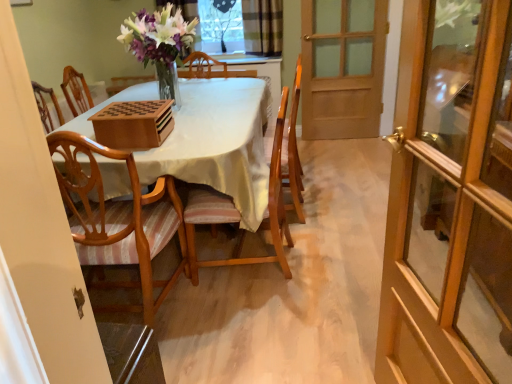
Identify the location of wooden door at right, which ranks as the first door in top-to-bottom order. The height and width of the screenshot is (384, 512). (342, 67).

Between point (280, 242) and point (77, 131), which one is positioned in front?

The point (77, 131) is closer to the camera.

Is wooden chair with striped cushion at center, positioned as the 1th chair in right-to-left order, thinner than wooden table at center?

Indeed, wooden chair with striped cushion at center, positioned as the 1th chair in right-to-left order, has a lesser width compared to wooden table at center.

Find the location of a particular element. This screenshot has width=512, height=384. chair on the right side of wooden table at center is located at coordinates (239, 213).

From a real-world perspective, is wooden chair with striped cushion at center, which appears as the 2th chair when viewed from the left, located higher than wooden table at center?

Yes, from a real-world perspective, wooden chair with striped cushion at center, which appears as the 2th chair when viewed from the left, is over wooden table at center

Is plaid fabric curtain at upper center positioned far away from light brown wood chair at left, the 2th chair when ordered from right to left?

Yes.

Find the location of a particular element. curtain lying on the right of light brown wood chair at left, the 2th chair when ordered from right to left is located at coordinates (263, 27).

Which object is further away from the camera taking this photo, plaid fabric curtain at upper center or light brown wood chair at left, which is the 1th chair from left to right?

plaid fabric curtain at upper center is further away from the camera.

From a real-world perspective, is plaid fabric curtain at upper center physically located above or below light brown wood chair at left, which is the 1th chair from left to right?

From a real-world perspective, plaid fabric curtain at upper center is physically above light brown wood chair at left, which is the 1th chair from left to right.

Can you confirm if wooden door at right, arranged as the 2th door when viewed from the front, is taller than wooden table at center?

Indeed, wooden door at right, arranged as the 2th door when viewed from the front, has a greater height compared to wooden table at center.

From a real-world perspective, between wooden door at right, the 1th door viewed from the back, and wooden table at center, who is vertically lower?

wooden table at center is physically lower.

In the image, is wooden door at right, arranged as the 2th door when viewed from the front, positioned in front of or behind wooden table at center?

wooden door at right, arranged as the 2th door when viewed from the front, is positioned farther from the viewer than wooden table at center.

Is wooden door at right, arranged as the 2th door when viewed from the front, far from wooden table at center?

wooden door at right, arranged as the 2th door when viewed from the front, is far away from wooden table at center.

Does light brown wood chair at left, the 2th chair when ordered from right to left, have a larger size compared to plaid fabric curtain at upper center?

Yes, light brown wood chair at left, the 2th chair when ordered from right to left, is bigger than plaid fabric curtain at upper center.

Considering the sizes of light brown wood chair at left, the 2th chair when ordered from right to left, and plaid fabric curtain at upper center in the image, is light brown wood chair at left, the 2th chair when ordered from right to left, taller or shorter than plaid fabric curtain at upper center?

Considering their sizes, light brown wood chair at left, the 2th chair when ordered from right to left, has more height than plaid fabric curtain at upper center.

Who is more distant, light brown wood chair at left, the 2th chair when ordered from right to left, or plaid fabric curtain at upper center?

plaid fabric curtain at upper center is more distant.

Is wooden chair with striped cushion at center, which appears as the 2th chair when viewed from the left, in contact with plaid fabric curtain at upper center?

No, wooden chair with striped cushion at center, which appears as the 2th chair when viewed from the left, is not touching plaid fabric curtain at upper center.

Does point (269, 259) appear closer or farther from the camera than point (245, 33)?

Point (269, 259) appears to be closer to the viewer than point (245, 33).

Is wooden chair with striped cushion at center, positioned as the 1th chair in right-to-left order, to the left of plaid fabric curtain at upper center from the viewer's perspective?

Indeed, wooden chair with striped cushion at center, positioned as the 1th chair in right-to-left order, is positioned on the left side of plaid fabric curtain at upper center.

Measure the distance from wooden chair with striped cushion at center, which appears as the 2th chair when viewed from the left, to plaid fabric curtain at upper center.

wooden chair with striped cushion at center, which appears as the 2th chair when viewed from the left, is 5.72 feet away from plaid fabric curtain at upper center.

Which object is wider, plaid fabric curtain at upper center or clear glass window at upper center?

With larger width is plaid fabric curtain at upper center.

Is plaid fabric curtain at upper center at the right side of clear glass window at upper center?

Yes.

From the image's perspective, is plaid fabric curtain at upper center located above or below clear glass window at upper center?

From the image's perspective, plaid fabric curtain at upper center appears below clear glass window at upper center.

Considering their positions, is plaid fabric curtain at upper center located in front of or behind clear glass window at upper center?

In the image, plaid fabric curtain at upper center appears in front of clear glass window at upper center.

Who is taller, wooden glass door at right, the first door positioned from the bottom, or wooden door at right, which ranks as the first door in top-to-bottom order?

wooden glass door at right, the first door positioned from the bottom.

Locate an element on the screen. door on the right side of wooden glass door at right, placed as the 2th door when sorted from back to front is located at coordinates (342, 67).

Is wooden glass door at right, the first door positioned from the bottom, bigger or smaller than wooden door at right, which is counted as the 2th door, starting from the bottom?

wooden glass door at right, the first door positioned from the bottom, is smaller than wooden door at right, which is counted as the 2th door, starting from the bottom.

Identify the location of kitchen & dining room table located on the left of wooden chair with striped cushion at center, positioned as the 1th chair in right-to-left order. (218, 150).

You are a GUI agent. You are given a task and a screenshot of the screen. Output one action in this format:
    pyautogui.click(x=<x>, y=<y>)
    Task: Click on the curtain behind the light brown wood chair at left, which is the 1th chair from left to right
    
    Given the screenshot: What is the action you would take?
    pyautogui.click(x=263, y=27)

Which object lies nearer to the anchor point wooden glass door at right, which is counted as the 2th door, starting from the top, light brown wood chair at left, the 2th chair when ordered from right to left, or wooden door at right, which ranks as the first door in top-to-bottom order?

light brown wood chair at left, the 2th chair when ordered from right to left, is closer to wooden glass door at right, which is counted as the 2th door, starting from the top.

From the image, which object appears to be farther from plaid fabric curtain at upper center, wooden glass door at right, which is counted as the 2th door, starting from the top, or clear glass window at upper center?

Based on the image, wooden glass door at right, which is counted as the 2th door, starting from the top, appears to be further to plaid fabric curtain at upper center.

Considering their positions, is wooden table at center positioned closer to wooden chair with striped cushion at center, which appears as the 2th chair when viewed from the left, than clear glass window at upper center?

wooden table at center is closer to wooden chair with striped cushion at center, which appears as the 2th chair when viewed from the left.

Considering their positions, is wooden door at right, arranged as the 2th door when viewed from the front, positioned further to wooden glass door at right, the first door positioned from the bottom, than plaid fabric curtain at upper center?

plaid fabric curtain at upper center is positioned further to the anchor wooden glass door at right, the first door positioned from the bottom.

Estimate the real-world distances between objects in this image. Which object is closer to plaid fabric curtain at upper center, wooden table at center or wooden door at right, the 1th door viewed from the back?

wooden door at right, the 1th door viewed from the back, is positioned closer to the anchor plaid fabric curtain at upper center.

Based on their spatial positions, is clear glass window at upper center or plaid fabric curtain at upper center closer to wooden door at right, the 1th door viewed from the back?

The object closer to wooden door at right, the 1th door viewed from the back, is plaid fabric curtain at upper center.

Based on their spatial positions, is wooden glass door at right, which is counted as the 2th door, starting from the top, or wooden table at center closer to light brown wood chair at left, which is the 1th chair from left to right?

wooden table at center.

Considering their positions, is light brown wood chair at left, the 2th chair when ordered from right to left, positioned further to wooden chair with striped cushion at center, which appears as the 2th chair when viewed from the left, than wooden table at center?

Based on the image, light brown wood chair at left, the 2th chair when ordered from right to left, appears to be further to wooden chair with striped cushion at center, which appears as the 2th chair when viewed from the left.

Find the location of a particular element. The image size is (512, 384). door located between wooden chair with striped cushion at center, which appears as the 2th chair when viewed from the left, and plaid fabric curtain at upper center in the depth direction is located at coordinates (342, 67).

I want to click on door positioned between light brown wood chair at left, which is the 1th chair from left to right, and clear glass window at upper center from near to far, so click(x=342, y=67).

You are a GUI agent. You are given a task and a screenshot of the screen. Output one action in this format:
    pyautogui.click(x=<x>, y=<y>)
    Task: Click on the door between wooden glass door at right, placed as the 2th door when sorted from back to front, and clear glass window at upper center, along the z-axis
    This screenshot has height=384, width=512.
    Given the screenshot: What is the action you would take?
    pyautogui.click(x=342, y=67)

The image size is (512, 384). What are the coordinates of `kitchen & dining room table positioned between light brown wood chair at left, which is the 1th chair from left to right, and clear glass window at upper center from near to far` in the screenshot? It's located at (218, 150).